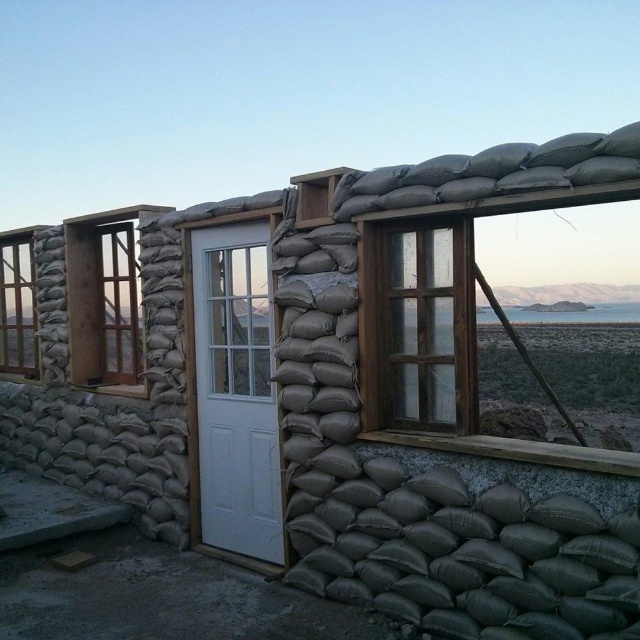
Question: Does white matte door at center have a lesser width compared to wooden-framed glass window at upper center?

Choices:
 (A) no
 (B) yes

Answer: (B)

Question: Can you confirm if white matte door at center is smaller than gray sandbags at upper center?

Choices:
 (A) no
 (B) yes

Answer: (A)

Question: Which object is the farthest from the gray sandbags at upper center?

Choices:
 (A) transparent glass window at center
 (B) wooden at left

Answer: (B)

Question: Is gray sandbags at upper center to the right of wooden at left from the viewer's perspective?

Choices:
 (A) no
 (B) yes

Answer: (B)

Question: Which of the following is the closest to the observer?

Choices:
 (A) wooden-framed window at left
 (B) wooden at left
 (C) transparent glass window at center

Answer: (C)

Question: Which object appears closest to the camera in this image?

Choices:
 (A) transparent glass window at center
 (B) wooden-framed glass window at upper center

Answer: (B)